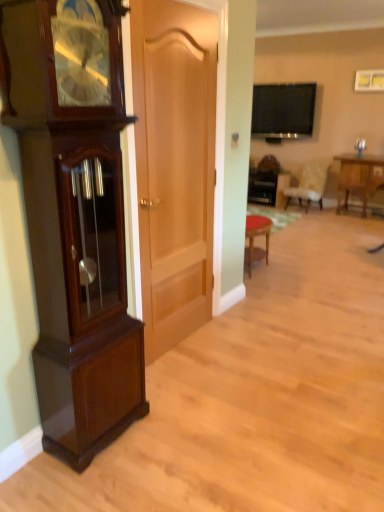
Identify the location of free space to the right of mahogany wood grandfather clock at left. The image size is (384, 512). (166, 437).